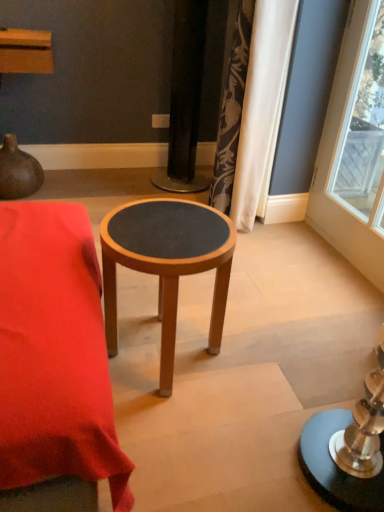
Find the location of `free space above wooden stool at center (from a real-world perspective)`. free space above wooden stool at center (from a real-world perspective) is located at coordinates (167, 225).